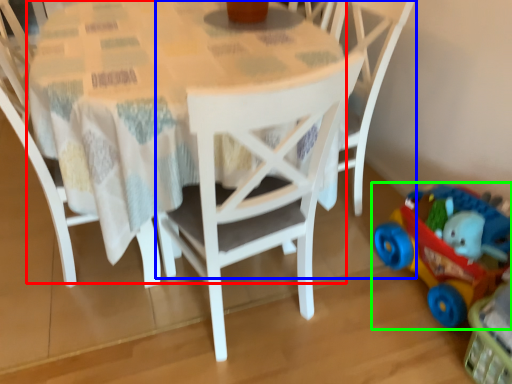
Question: Which object is the farthest from round table (highlighted by a red box)? Choose among these: chair (highlighted by a blue box) or toy (highlighted by a green box).

Choices:
 (A) chair
 (B) toy

Answer: (B)